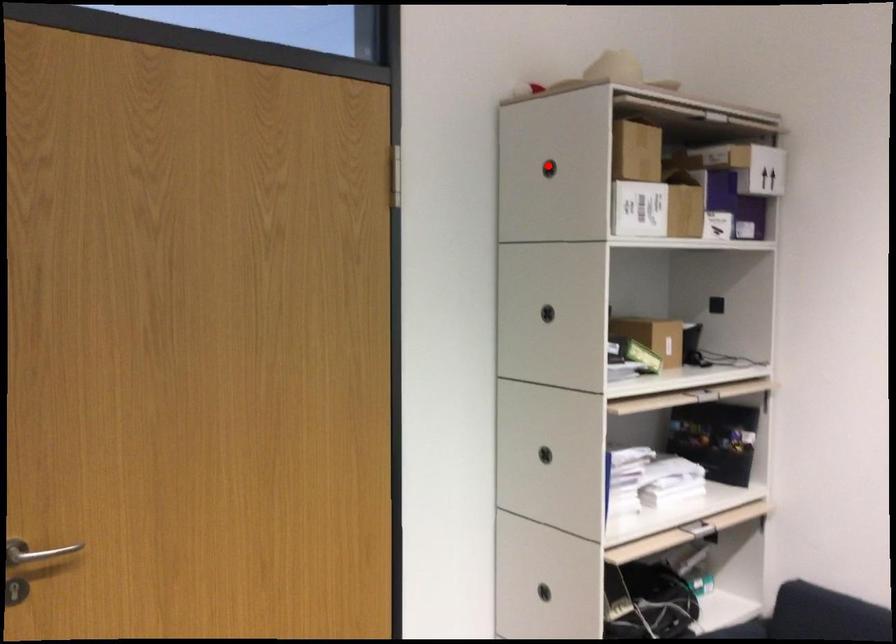
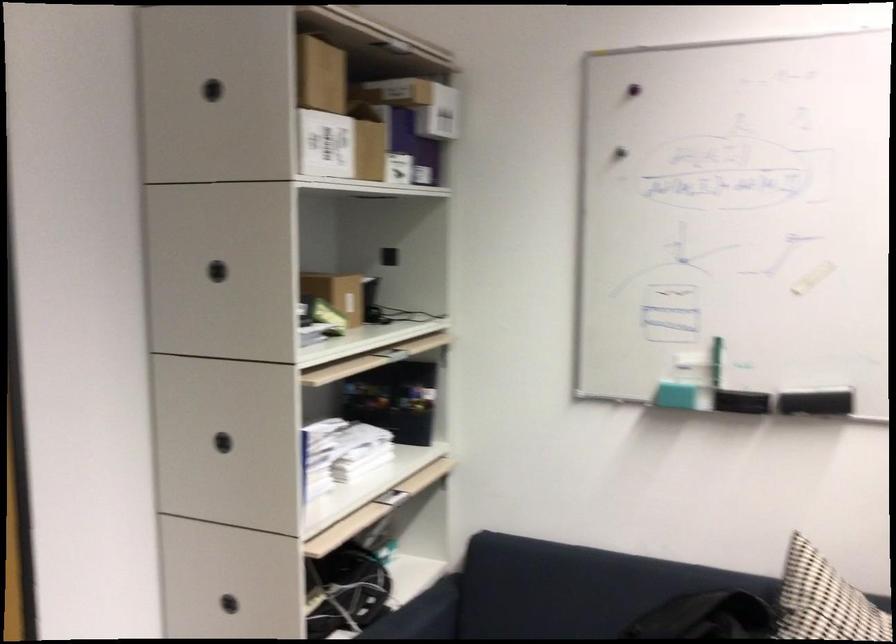
Question: I am providing you with two images of the same scene from different viewpoints. A red point is marked on the first image. At the location where the point appears in image 1, is it still visible in image 2?

Choices:
 (A) Yes
 (B) No

Answer: (A)